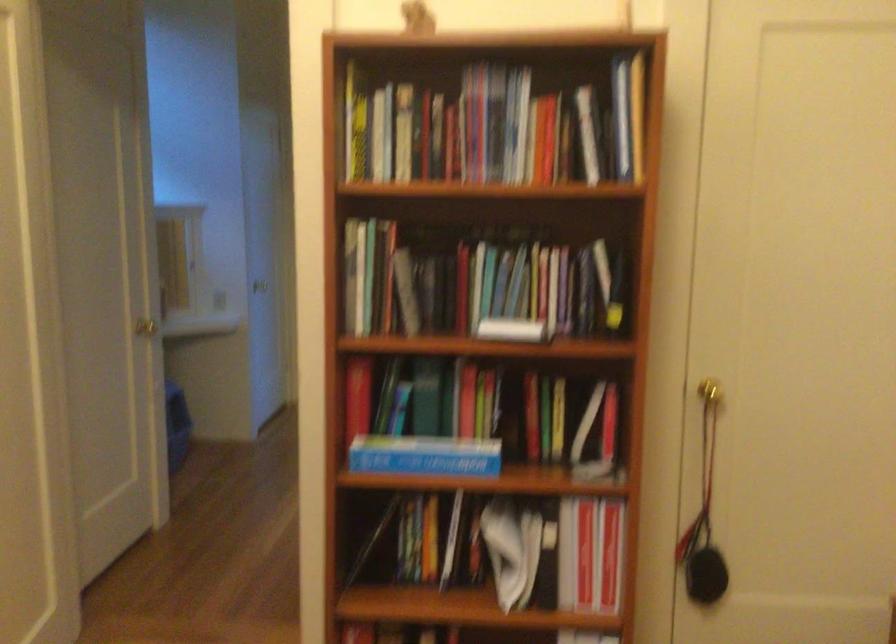
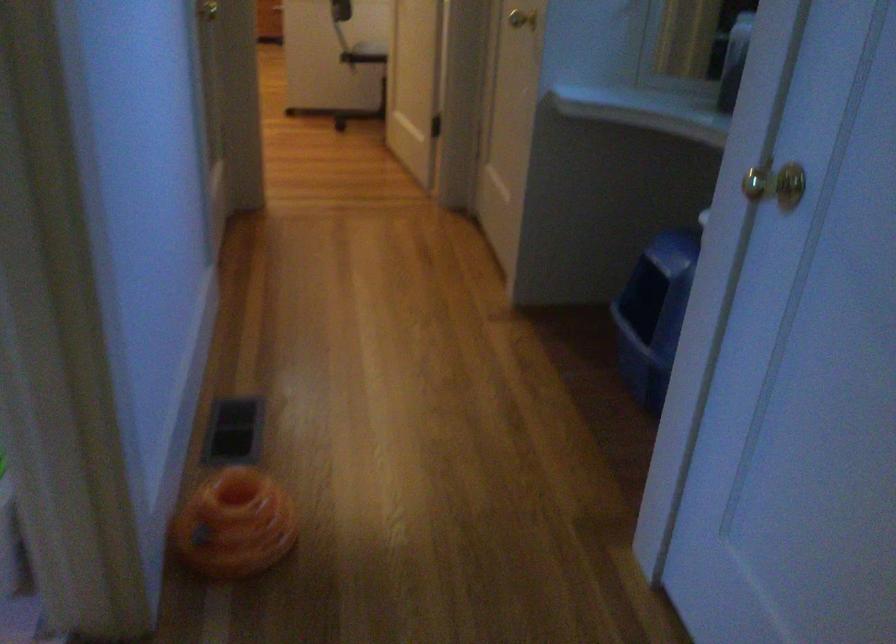
The point at (126,343) is marked in the first image. Where is the corresponding point in the second image?

(521, 19)